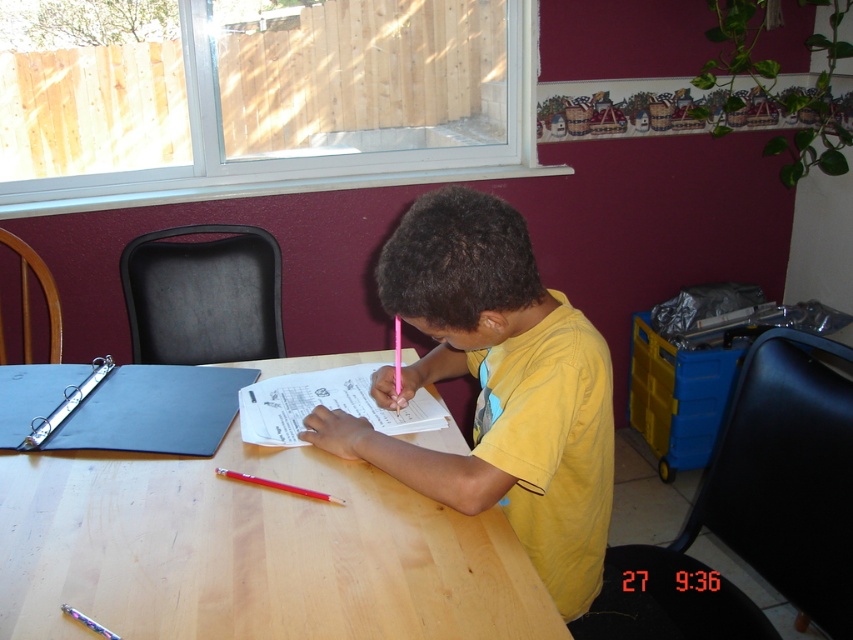
Does yellow matte shirt at center come behind white paper at center?

No, yellow matte shirt at center is closer to the viewer.

From the picture: Does yellow matte shirt at center have a larger size compared to white paper at center?

Correct, yellow matte shirt at center is larger in size than white paper at center.

Who is more distant from viewer, (579,508) or (416,426)?

The point (416,426) is more distant.

The width and height of the screenshot is (853, 640). What are the coordinates of `yellow matte shirt at center` in the screenshot? It's located at (496, 387).

Can you confirm if light brown wood table at center is wider than blue fabric binder at upper left?

Indeed, light brown wood table at center has a greater width compared to blue fabric binder at upper left.

Who is lower down, light brown wood table at center or blue fabric binder at upper left?

light brown wood table at center is below.

Where is `light brown wood table at center`? Image resolution: width=853 pixels, height=640 pixels. light brown wood table at center is located at coordinates (251, 552).

Which of these two, white paper at center or red plastic pen at table center, stands shorter?

With less height is red plastic pen at table center.

Can you confirm if white paper at center is taller than red plastic pen at table center?

Yes, white paper at center is taller than red plastic pen at table center.

I want to click on white paper at center, so click(x=328, y=404).

Where is `white paper at center`? Image resolution: width=853 pixels, height=640 pixels. white paper at center is located at coordinates (328, 404).